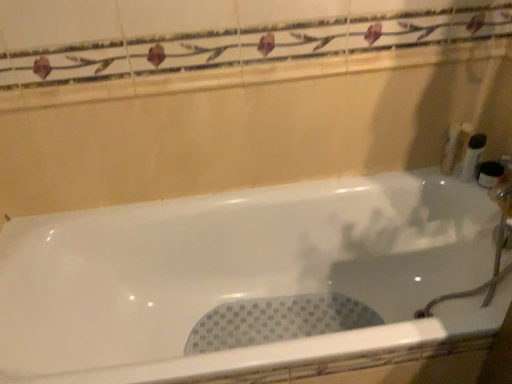
You are a GUI agent. You are given a task and a screenshot of the screen. Output one action in this format:
    pyautogui.click(x=<x>, y=<y>)
    Task: Click on the vacant region to the left of white plastic bottle at right, arranged as the 3th toiletry when viewed from the left
    The height and width of the screenshot is (384, 512).
    Given the screenshot: What is the action you would take?
    pyautogui.click(x=426, y=179)